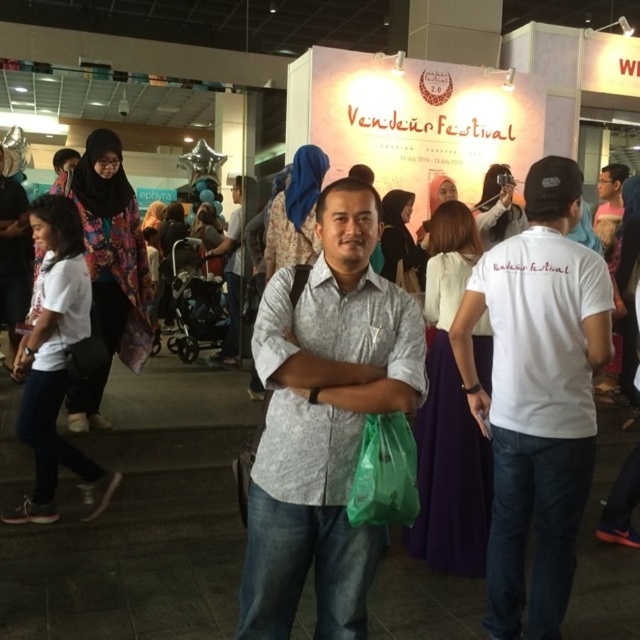
At the Vendeur Festival, you notice two items at the center of the scene. The blue satin hijab at center and the matte white shirt at center. Which one is positioned to the right of the other?

The blue satin hijab at center is to the right of the matte white shirt at center.